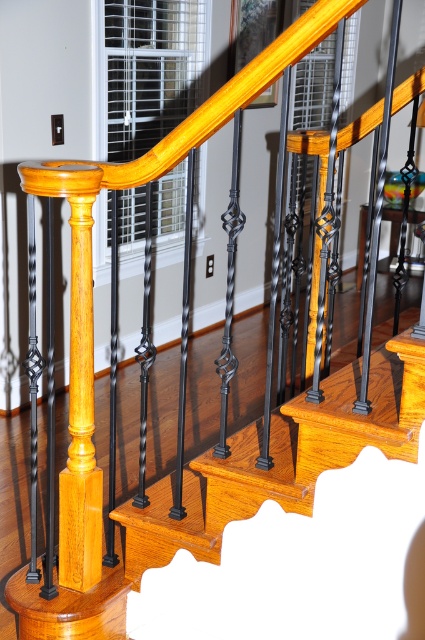
Who is lower down, matte black wrought iron at center or light brown wood post at center?

matte black wrought iron at center is below.

Does matte black wrought iron at center have a larger size compared to light brown wood post at center?

Correct, matte black wrought iron at center is larger in size than light brown wood post at center.

Image resolution: width=425 pixels, height=640 pixels. I want to click on matte black wrought iron at center, so click(283, 458).

Image resolution: width=425 pixels, height=640 pixels. Identify the location of matte black wrought iron at center. (283, 458).